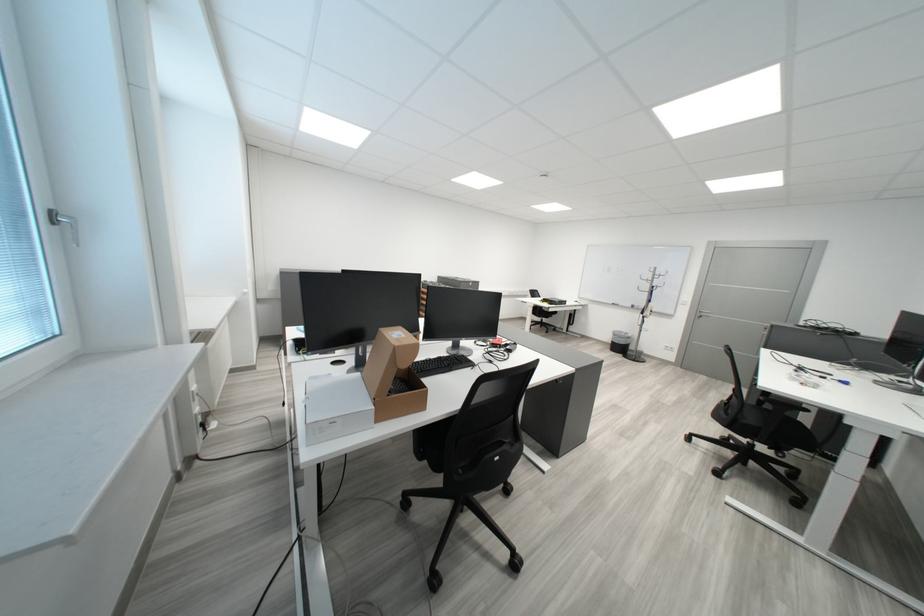
Find where to lift the open cardboard box. Please return your answer as a coordinate pair (x, y).

(394, 375)